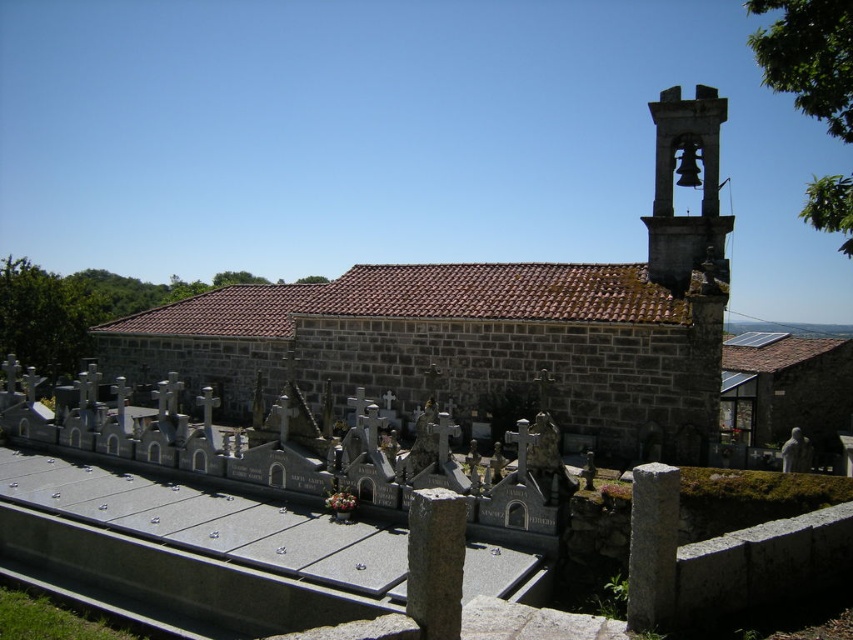
Between brown stone church at center and matte gray stone bell tower at upper right, which one has more height?

Standing taller between the two is brown stone church at center.

Between point (677, 392) and point (659, 211), which one is positioned behind?

Point (659, 211)

What do you see at coordinates (495, 323) in the screenshot? I see `brown stone church at center` at bounding box center [495, 323].

The height and width of the screenshot is (640, 853). Identify the location of brown stone church at center. (495, 323).